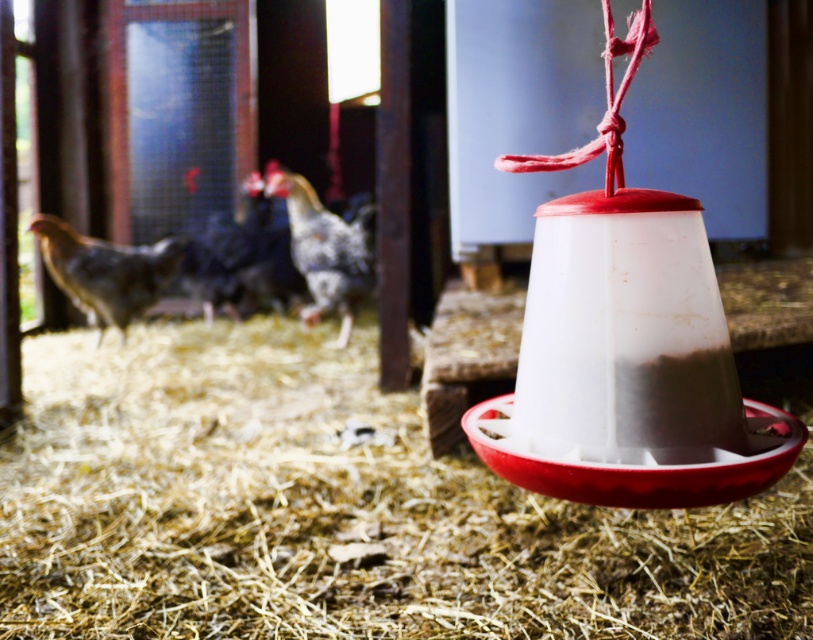
Question: Among these objects, which one is nearest to the camera?

Choices:
 (A) speckled feathered chicken at left
 (B) speckled feathered chicken at center

Answer: (A)

Question: Can you confirm if speckled feathered chicken at left is thinner than blue speckled feathers at center?

Choices:
 (A) yes
 (B) no

Answer: (A)

Question: Which point is closer to the camera?

Choices:
 (A) (75, 273)
 (B) (394, 588)
 (C) (250, 288)

Answer: (B)

Question: Among these points, which one is nearest to the camera?

Choices:
 (A) (646, 632)
 (B) (225, 250)
 (C) (303, 243)
 (D) (55, 257)

Answer: (A)

Question: Does speckled feathered chicken at left come in front of blue speckled feathers at center?

Choices:
 (A) no
 (B) yes

Answer: (B)

Question: Is brown straw at center positioned in front of speckled feathered chicken at left?

Choices:
 (A) no
 (B) yes

Answer: (B)